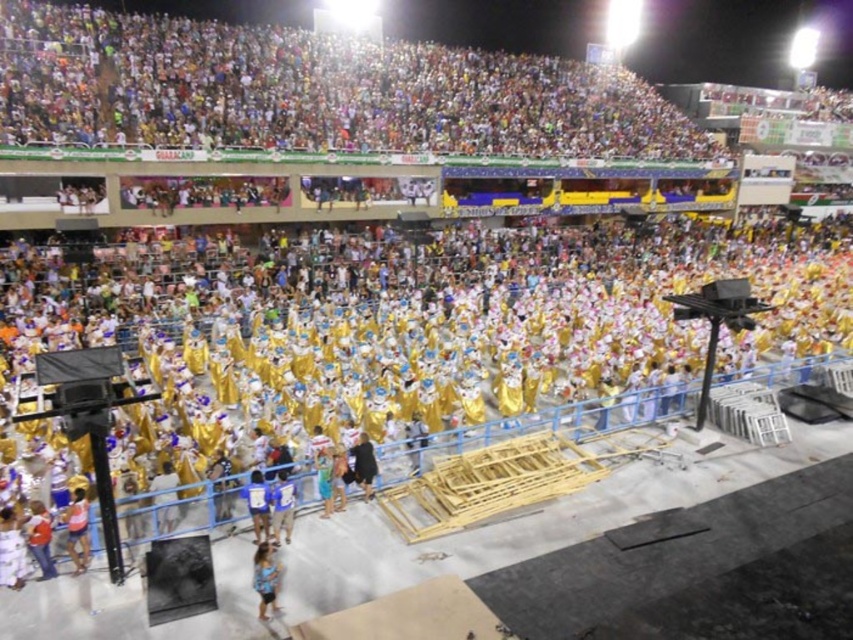
You are at the center of the stage and need to find the black fabric person at center. According to the coordinates provided, where exactly should you look?

The black fabric person at center is located at point coordinates (364, 465).

You are an event organizer at the carnival and need to arrange performers based on their clothing height. Which of the two items, the blue fabric dress at lower center or the blue fabric shirt at lower center, should be placed higher up to ensure visibility?

The blue fabric shirt at lower center should be placed higher up since it has a greater height compared to the blue fabric dress at lower center, ensuring better visibility for the spectators.